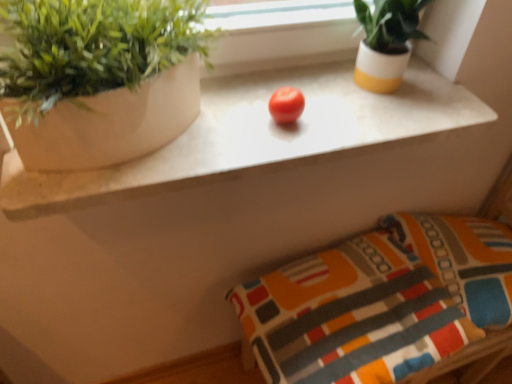
Where is `free space above white marble counter at center (from a real-world perspective)`? free space above white marble counter at center (from a real-world perspective) is located at coordinates (303, 112).